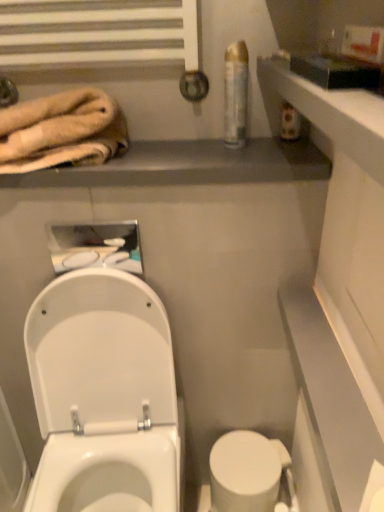
This screenshot has width=384, height=512. Describe the element at coordinates (235, 94) in the screenshot. I see `clear plastic can at upper right` at that location.

Locate an element on the screen. white glossy toilet bowl at lower center is located at coordinates (245, 472).

What do you see at coordinates (103, 395) in the screenshot? The image size is (384, 512). I see `white glossy toilet at lower left` at bounding box center [103, 395].

In order to face beige plush towel at upper left, should I rotate leftwards or rightwards?

You should rotate left by 18.915 degrees.

The height and width of the screenshot is (512, 384). What do you see at coordinates (189, 165) in the screenshot?
I see `metallic gray balustrade at upper center` at bounding box center [189, 165].

Identify the location of clear plastic can at upper right. (235, 94).

Considering the sizes of objects metallic gray balustrade at upper center and beige plush towel at upper left in the image provided, who is wider, metallic gray balustrade at upper center or beige plush towel at upper left?

With larger width is metallic gray balustrade at upper center.

Does metallic gray balustrade at upper center have a greater height compared to beige plush towel at upper left?

No.

Is metallic gray balustrade at upper center spatially inside beige plush towel at upper left, or outside of it?

metallic gray balustrade at upper center lies outside beige plush towel at upper left.

Could you tell me if metallic gray balustrade at upper center is turned towards beige plush towel at upper left?

No, metallic gray balustrade at upper center is not oriented towards beige plush towel at upper left.

Identify the location of bath towel lying above the white glossy toilet at lower left (from the image's perspective). (61, 131).

Considering the positions of points (82, 498) and (29, 157), is point (82, 498) farther from camera compared to point (29, 157)?

Yes.

From a real-world perspective, is white glossy toilet at lower left positioned under beige plush towel at upper left based on gravity?

Yes, from a real-world perspective, white glossy toilet at lower left is below beige plush towel at upper left.

In the scene shown: Which object is positioned more to the right, metallic gray balustrade at upper center or white glossy toilet bowl at lower center?

From the viewer's perspective, white glossy toilet bowl at lower center appears more on the right side.

Between point (27, 179) and point (258, 486), which one is positioned in front?

Point (27, 179)

Could you tell me if metallic gray balustrade at upper center is turned towards white glossy toilet bowl at lower center?

No, metallic gray balustrade at upper center is not aimed at white glossy toilet bowl at lower center.

Based on the photo, is metallic gray balustrade at upper center situated inside white glossy toilet bowl at lower center or outside?

metallic gray balustrade at upper center is located beyond the bounds of white glossy toilet bowl at lower center.

From a real-world perspective, is white glossy toilet bowl at lower center physically below white glossy toilet at lower left?

Yes, from a real-world perspective, white glossy toilet bowl at lower center is beneath white glossy toilet at lower left.

Is white glossy toilet bowl at lower center shorter than white glossy toilet at lower left?

Yes, white glossy toilet bowl at lower center is shorter than white glossy toilet at lower left.

From the image's perspective, which one is positioned lower, white glossy toilet bowl at lower center or white glossy toilet at lower left?

white glossy toilet bowl at lower center.

Is white glossy toilet bowl at lower center bigger than white glossy toilet at lower left?

Incorrect, white glossy toilet bowl at lower center is not larger than white glossy toilet at lower left.

Is beige plush towel at upper left wider than clear plastic can at upper right?

Yes.

Can you confirm if beige plush towel at upper left is smaller than clear plastic can at upper right?

Incorrect, beige plush towel at upper left is not smaller in size than clear plastic can at upper right.

Can you confirm if beige plush towel at upper left is taller than clear plastic can at upper right?

In fact, beige plush towel at upper left may be shorter than clear plastic can at upper right.

Which object is positioned more to the right, beige plush towel at upper left or clear plastic can at upper right?

clear plastic can at upper right is more to the right.

What's the angular difference between white glossy toilet at lower left and white glossy toilet bowl at lower center's facing directions?

0.00035 degrees.

Who is more distant, white glossy toilet at lower left or white glossy toilet bowl at lower center?

white glossy toilet bowl at lower center.

From a real-world perspective, which is physically above, white glossy toilet at lower left or white glossy toilet bowl at lower center?

In real-world perspective, white glossy toilet at lower left is above.

Is there a large distance between white glossy toilet at lower left and white glossy toilet bowl at lower center?

white glossy toilet at lower left is actually quite close to white glossy toilet bowl at lower center.

From the image's perspective, is beige plush towel at upper left located above or below white glossy toilet at lower left?

Based on their image positions, beige plush towel at upper left is located above white glossy toilet at lower left.

Is white glossy toilet at lower left completely or partially inside beige plush towel at upper left?

Actually, white glossy toilet at lower left is outside beige plush towel at upper left.

Is beige plush towel at upper left wider than white glossy toilet at lower left?

Incorrect, the width of beige plush towel at upper left does not surpass that of white glossy toilet at lower left.

Could you tell me if beige plush towel at upper left is facing white glossy toilet at lower left?

No, beige plush towel at upper left is not turned towards white glossy toilet at lower left.

Locate an element on the screen. This screenshot has height=512, width=384. bath towel that appears on the left of metallic gray balustrade at upper center is located at coordinates (61, 131).

Where is `toilet that is below the beige plush towel at upper left (from the image's perspective)`? The image size is (384, 512). toilet that is below the beige plush towel at upper left (from the image's perspective) is located at coordinates (103, 395).

From the image, which object appears to be nearer to beige plush towel at upper left, clear plastic can at upper right or white glossy toilet bowl at lower center?

clear plastic can at upper right lies closer to beige plush towel at upper left than the other object.

When comparing their distances from metallic gray balustrade at upper center, does clear plastic can at upper right or beige plush towel at upper left seem further?

clear plastic can at upper right.

Looking at the image, which one is located further to clear plastic can at upper right, beige plush towel at upper left or white glossy toilet at lower left?

Based on the image, white glossy toilet at lower left appears to be further to clear plastic can at upper right.

From the image, which object appears to be nearer to clear plastic can at upper right, metallic gray balustrade at upper center or white glossy toilet bowl at lower center?

The object closer to clear plastic can at upper right is metallic gray balustrade at upper center.

Which object lies nearer to the anchor point white glossy toilet at lower left, clear plastic can at upper right or metallic gray balustrade at upper center?

metallic gray balustrade at upper center lies closer to white glossy toilet at lower left than the other object.

Estimate the real-world distances between objects in this image. Which object is further from white glossy toilet at lower left, beige plush towel at upper left or metallic gray balustrade at upper center?

beige plush towel at upper left is positioned further to the anchor white glossy toilet at lower left.

Estimate the real-world distances between objects in this image. Which object is further from metallic gray balustrade at upper center, white glossy toilet at lower left or clear plastic can at upper right?

Based on the image, white glossy toilet at lower left appears to be further to metallic gray balustrade at upper center.

Based on their spatial positions, is white glossy toilet at lower left or clear plastic can at upper right closer to beige plush towel at upper left?

Based on the image, clear plastic can at upper right appears to be nearer to beige plush towel at upper left.

This screenshot has width=384, height=512. I want to click on toilet that lies between metallic gray balustrade at upper center and white glossy toilet bowl at lower center from top to bottom, so click(103, 395).

Image resolution: width=384 pixels, height=512 pixels. What are the coordinates of `balustrade between beige plush towel at upper left and white glossy toilet at lower left in the up-down direction` in the screenshot? It's located at (189, 165).

Identify the location of balustrade between beige plush towel at upper left and white glossy toilet bowl at lower center from top to bottom. (189, 165).

The image size is (384, 512). I want to click on bath towel between clear plastic can at upper right and white glossy toilet bowl at lower center in the up-down direction, so pyautogui.click(x=61, y=131).